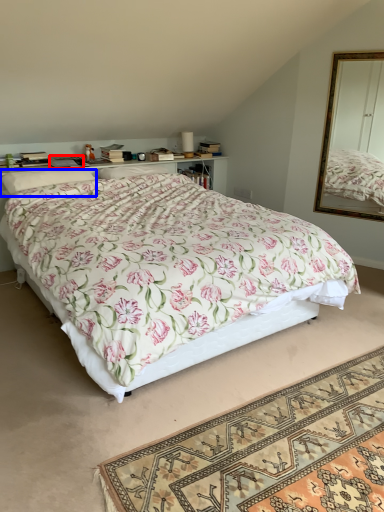
Question: Which object is closer to the camera taking this photo, book (highlighted by a red box) or pillow (highlighted by a blue box)?

Choices:
 (A) book
 (B) pillow

Answer: (B)